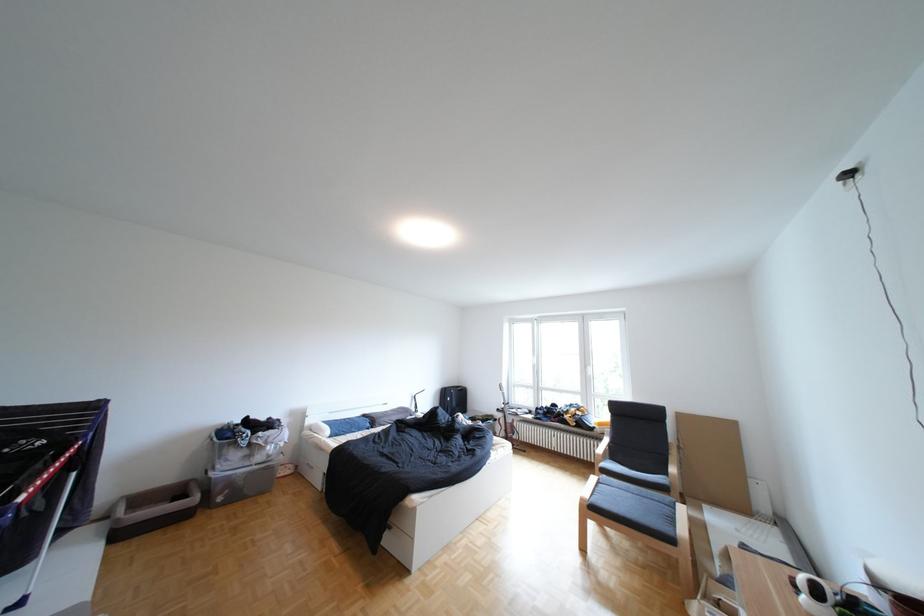
Where is `white window handle`? The image size is (924, 616). white window handle is located at coordinates (585, 383).